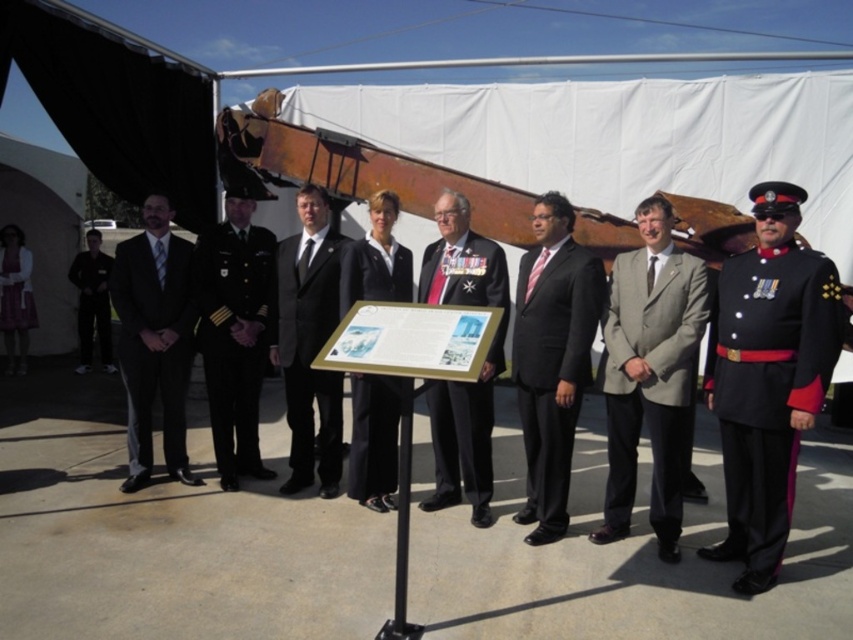
How far apart are shiny black uniform at right and black smooth suit at center?

shiny black uniform at right is 2.22 meters from black smooth suit at center.

Can you confirm if shiny black uniform at right is smaller than black smooth suit at center?

No.

Identify the location of shiny black uniform at right. This screenshot has width=853, height=640. (769, 376).

Who is taller, black uniform at center or black uniform at left?

black uniform at center

Can you confirm if black uniform at center is wider than black uniform at left?

Incorrect, black uniform at center's width does not surpass black uniform at left's.

Who is more forward, (225, 228) or (94, 230)?

Point (225, 228) is in front.

Locate an element on the screen. black uniform at center is located at coordinates (235, 332).

Who is positioned more to the right, black satin suit at center or black uniform at left?

black satin suit at center is more to the right.

Is point (335, 480) positioned in front of point (99, 248)?

Yes, point (335, 480) is in front of point (99, 248).

Which is behind, point (340, 237) or point (91, 294)?

Positioned behind is point (91, 294).

You are a GUI agent. You are given a task and a screenshot of the screen. Output one action in this format:
    pyautogui.click(x=<x>, y=<y>)
    Task: Click on the black satin suit at center
    The width and height of the screenshot is (853, 640).
    Given the screenshot: What is the action you would take?
    pyautogui.click(x=309, y=342)